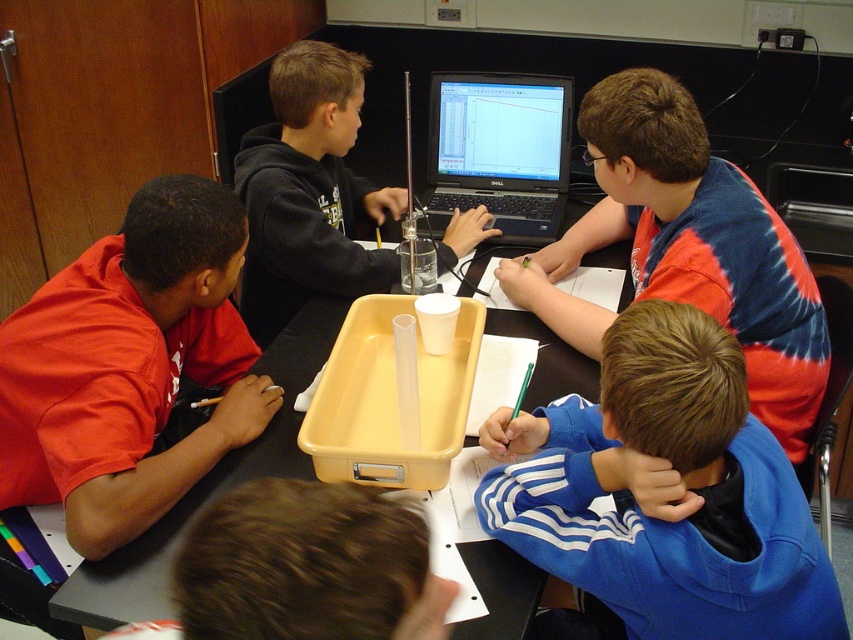
Can you confirm if black plastic tray at center is shorter than black plastic laptop at center?

Correct, black plastic tray at center is not as tall as black plastic laptop at center.

Is the position of black plastic tray at center less distant than that of black plastic laptop at center?

Yes, black plastic tray at center is closer to the viewer.

Which is behind, point (630, 275) or point (479, 108)?

Point (479, 108)

Where is `black plastic tray at center`? The width and height of the screenshot is (853, 640). black plastic tray at center is located at coordinates (207, 484).

Who is shorter, matte red shirt at left or matte black hoodie at center?

matte red shirt at left

Can you confirm if matte red shirt at left is bigger than matte black hoodie at center?

Incorrect, matte red shirt at left is not larger than matte black hoodie at center.

Is point (55, 276) in front of point (328, 173)?

Yes, it is.

I want to click on matte red shirt at left, so click(x=129, y=365).

Who is shorter, blue tie-dye shirt at upper right or matte black hoodie at center?

Standing shorter between the two is matte black hoodie at center.

Is point (810, 403) closer to camera compared to point (300, 76)?

Yes, point (810, 403) is closer to viewer.

Identify the location of blue tie-dye shirt at upper right. The image size is (853, 640). (686, 248).